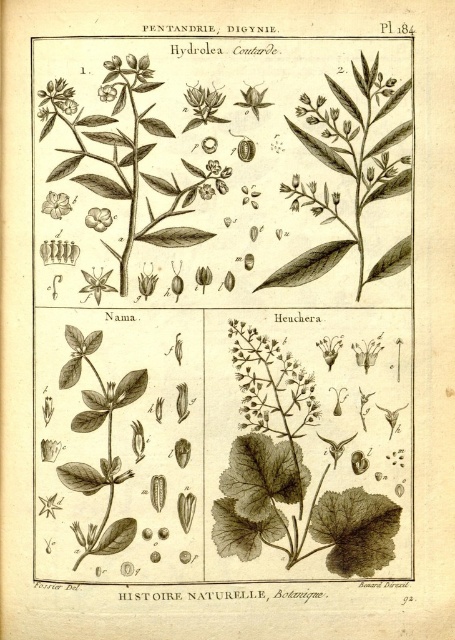
Question: Which object is closer to the camera taking this photo?

Choices:
 (A) smooth green leaf at upper center
 (B) smooth white flower at center
 (C) smooth white flower at upper left
 (D) matte yellow flower at upper left

Answer: (C)

Question: Does smooth green leaf at upper center lie behind matte yellow flower at upper left?

Choices:
 (A) yes
 (B) no

Answer: (B)

Question: Which point appears farthest from the camera in this image?

Choices:
 (A) (106, 227)
 (B) (45, 209)
 (C) (212, 120)

Answer: (A)

Question: Can you confirm if smooth green leaf at upper center is wider than smooth white flower at upper left?

Choices:
 (A) no
 (B) yes

Answer: (B)

Question: Does black ink plant at upper center have a larger size compared to smooth green leaf at upper center?

Choices:
 (A) yes
 (B) no

Answer: (A)

Question: Which object is farther from the camera taking this photo?

Choices:
 (A) smooth white flower at upper left
 (B) smooth green leaf at upper center
 (C) smooth white flower at center

Answer: (C)